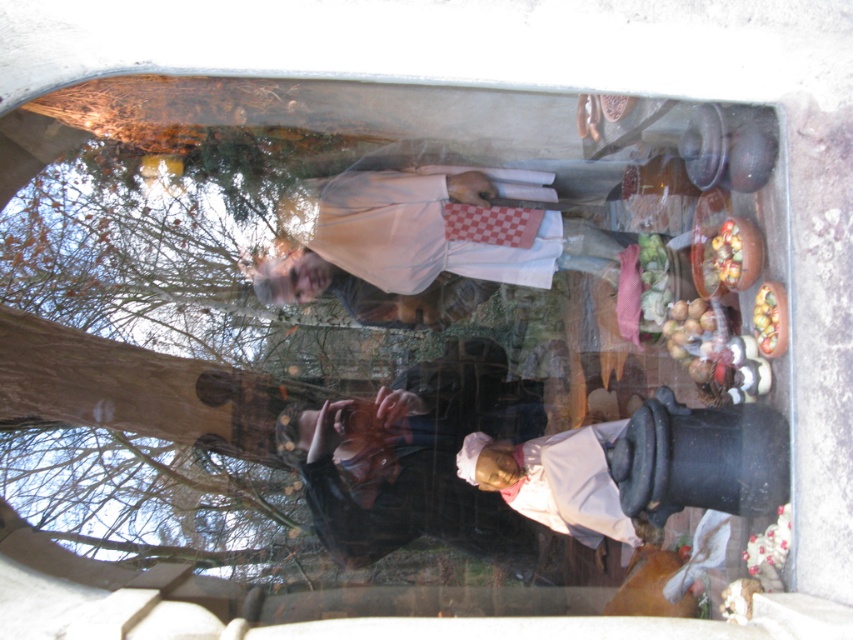
You are a chef trying to place a new hat on your head. You currently have the pink fabric headscarf at center. Can you fit the matte white chef hat at center on top of it without overlapping?

The distance between the pink fabric headscarf at center and the matte white chef hat at center is 55.26 centimeters, so yes, the chef hat can be placed on top without overlapping as there is sufficient space between them.

You are standing in the scene and need to place a 5.5 feet long decorative ribbon between the pink fabric headscarf at center and the shiny metallic bowl at right. Will the ribbon fit between them?

The distance between the pink fabric headscarf at center and the shiny metallic bowl at right is 5.45 feet, which is slightly shorter than the 5.5 feet long ribbon. Therefore, the ribbon will not fit between them without overlapping or bending.